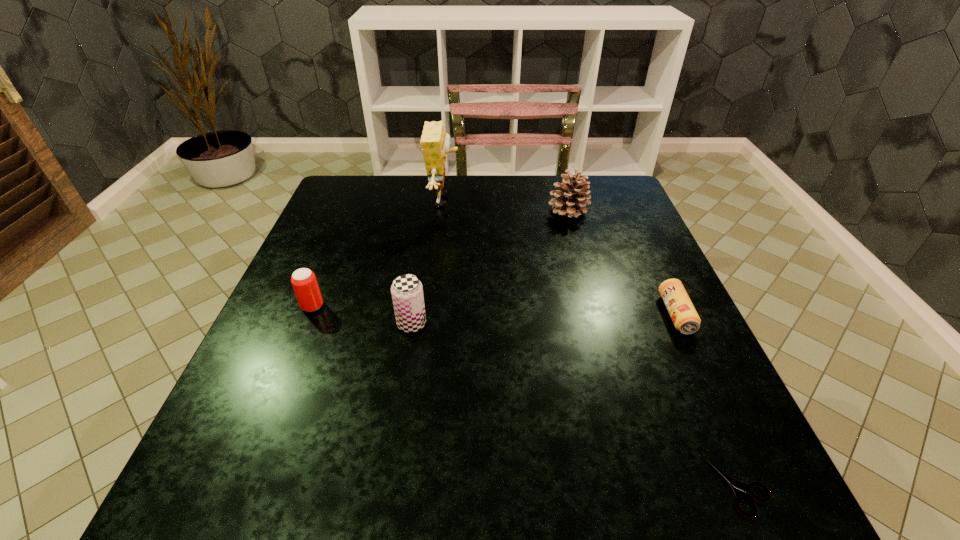
Identify the location of the second closest object relative to the third object from right to left. The image size is (960, 540). (686, 320).

Locate an element on the screen. beer can that stands as the closest to the tallest object is located at coordinates (407, 292).

Locate an element on the screen. This screenshot has width=960, height=540. beer can object that ranks as the closest to the leftmost object is located at coordinates (x=407, y=292).

The image size is (960, 540). Find the location of `blank area in the image that satisfies the following two spatial constraints: 1. on the face of the sponge; 2. on the left side of the shortest object`. blank area in the image that satisfies the following two spatial constraints: 1. on the face of the sponge; 2. on the left side of the shortest object is located at coordinates (410, 488).

Image resolution: width=960 pixels, height=540 pixels. Find the location of `vacant area in the image that satisfies the following two spatial constraints: 1. on the face of the pinecone; 2. on the left side of the sponge`. vacant area in the image that satisfies the following two spatial constraints: 1. on the face of the pinecone; 2. on the left side of the sponge is located at coordinates (443, 211).

This screenshot has height=540, width=960. Identify the location of free space that satisfies the following two spatial constraints: 1. on the back side of the shortest object; 2. on the right side of the second shortest object. (664, 314).

Where is `blank space that satisfies the following two spatial constraints: 1. on the face of the sponge; 2. on the right side of the nearest object`? This screenshot has width=960, height=540. blank space that satisfies the following two spatial constraints: 1. on the face of the sponge; 2. on the right side of the nearest object is located at coordinates (410, 488).

Find the location of a particular element. The image size is (960, 540). free space that satisfies the following two spatial constraints: 1. on the face of the shortest object; 2. on the right side of the tallest object is located at coordinates (410, 488).

You are a GUI agent. You are given a task and a screenshot of the screen. Output one action in this format:
    pyautogui.click(x=<x>, y=<y>)
    Task: Click on the free location that satisfies the following two spatial constraints: 1. on the back side of the third object from right to left; 2. on the left side of the tallest beer can
    This screenshot has width=960, height=540.
    Given the screenshot: What is the action you would take?
    (x=430, y=211)